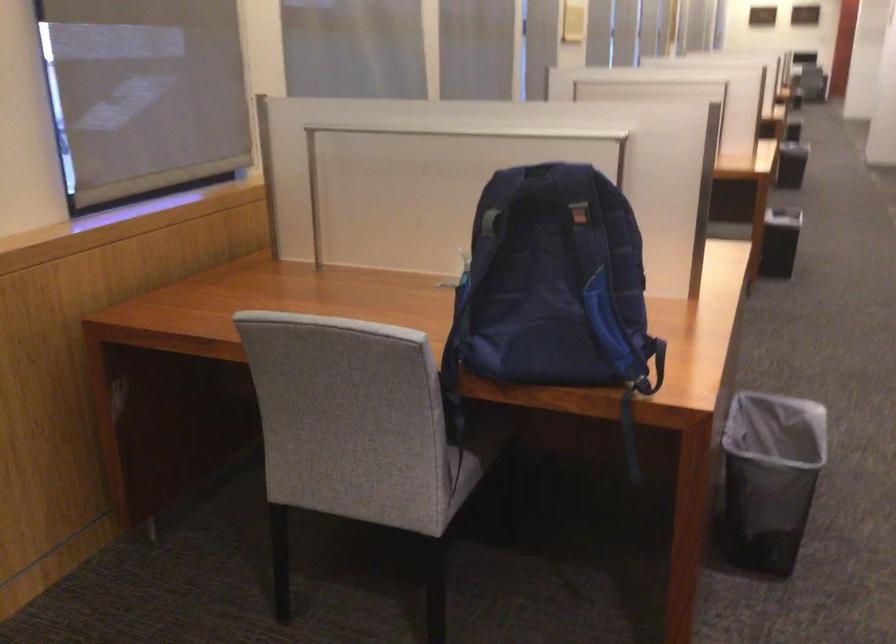
What do you see at coordinates (538, 184) in the screenshot? I see `a backpack handle` at bounding box center [538, 184].